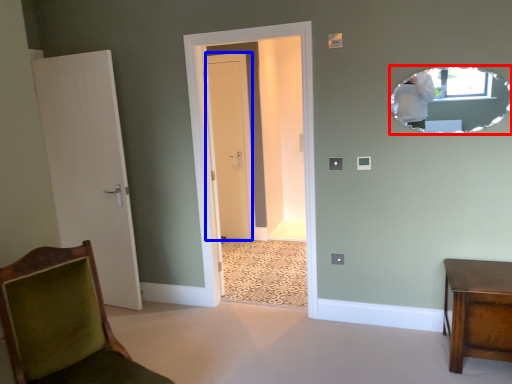
Question: Which of the following is the farthest to the observer, mirror (highlighted by a red box) or door (highlighted by a blue box)?

Choices:
 (A) mirror
 (B) door

Answer: (B)